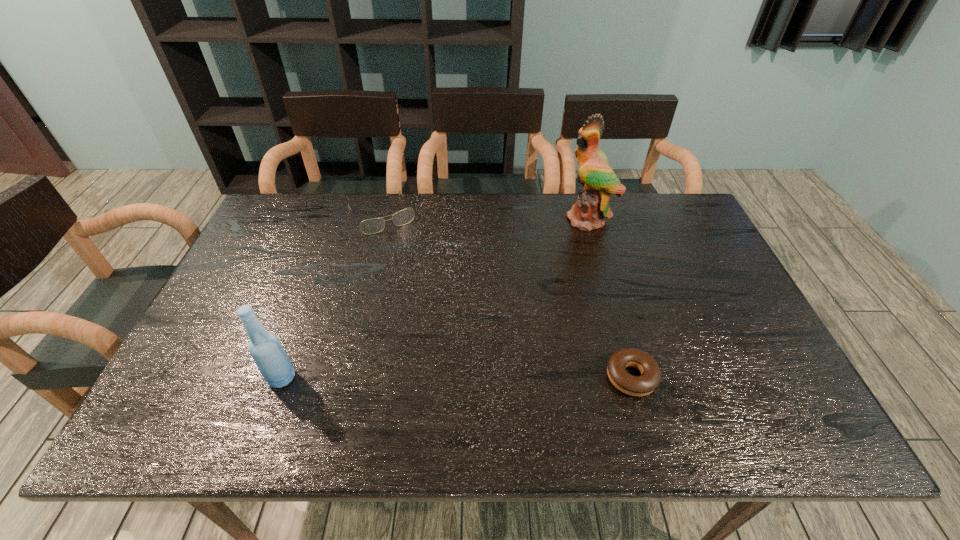
Locate an element on the screen. This screenshot has height=540, width=960. free space at the near left corner of the desktop is located at coordinates (226, 386).

The image size is (960, 540). Identify the location of free region at the far right corner of the desktop. (698, 226).

The height and width of the screenshot is (540, 960). Identify the location of vacant space at the near right corner of the desktop. (778, 383).

Locate an element on the screen. The image size is (960, 540). blank region between the bottle and the parrot is located at coordinates (436, 298).

Find the location of a particular element. The height and width of the screenshot is (540, 960). free space that is in between the parrot and the spectacles is located at coordinates (486, 217).

Where is `vacant space that is in between the third tallest object and the tallest object`? Image resolution: width=960 pixels, height=540 pixels. vacant space that is in between the third tallest object and the tallest object is located at coordinates (486, 217).

Where is `vacant space that's between the third shortest object and the third tallest object`? This screenshot has height=540, width=960. vacant space that's between the third shortest object and the third tallest object is located at coordinates (332, 296).

The width and height of the screenshot is (960, 540). Find the location of `free space that is in between the tallest object and the third tallest object`. free space that is in between the tallest object and the third tallest object is located at coordinates (486, 217).

You are a GUI agent. You are given a task and a screenshot of the screen. Output one action in this format:
    pyautogui.click(x=<x>, y=<y>)
    Task: Click on the free area in between the parrot and the shortest object
    
    Given the screenshot: What is the action you would take?
    pyautogui.click(x=611, y=298)

Locate an element on the screen. This screenshot has height=540, width=960. empty space that is in between the tallest object and the bottle is located at coordinates (436, 298).